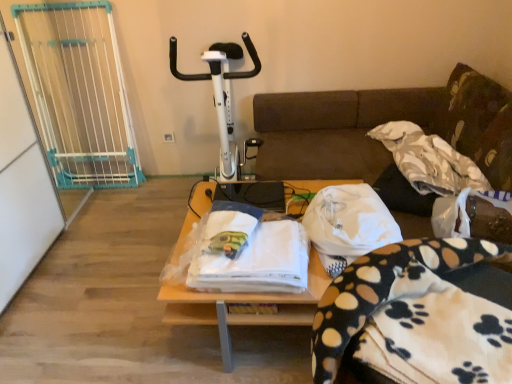
The height and width of the screenshot is (384, 512). Find the location of `free region on the left part of wooden table at center`. free region on the left part of wooden table at center is located at coordinates (109, 295).